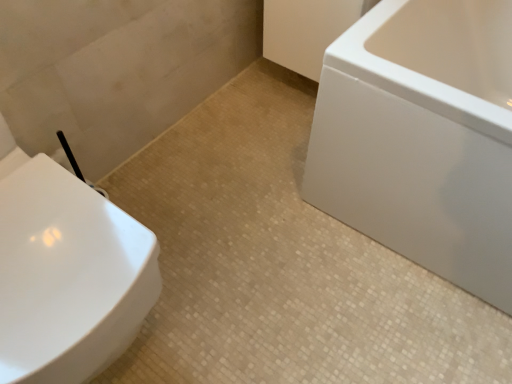
Question: From a real-world perspective, is white glossy bathtub at right positioned over beige mosaic tile at center based on gravity?

Choices:
 (A) yes
 (B) no

Answer: (A)

Question: Does white glossy bathtub at right appear on the left side of beige mosaic tile at center?

Choices:
 (A) yes
 (B) no

Answer: (B)

Question: Does white glossy bathtub at right appear on the right side of beige mosaic tile at center?

Choices:
 (A) yes
 (B) no

Answer: (A)

Question: Is the depth of white glossy bathtub at right less than that of beige mosaic tile at center?

Choices:
 (A) yes
 (B) no

Answer: (A)

Question: Can beige mosaic tile at center be found inside white glossy bathtub at right?

Choices:
 (A) no
 (B) yes

Answer: (A)

Question: Is white glossy bathtub at right further to camera compared to beige mosaic tile at center?

Choices:
 (A) no
 (B) yes

Answer: (A)

Question: Does beige mosaic tile at center have a larger size compared to white glossy toilet at left?

Choices:
 (A) yes
 (B) no

Answer: (B)

Question: Considering the relative positions of beige mosaic tile at center and white glossy toilet at left in the image provided, is beige mosaic tile at center behind white glossy toilet at left?

Choices:
 (A) yes
 (B) no

Answer: (A)

Question: From a real-world perspective, is beige mosaic tile at center beneath white glossy toilet at left?

Choices:
 (A) yes
 (B) no

Answer: (A)

Question: Considering the relative sizes of beige mosaic tile at center and white glossy toilet at left in the image provided, is beige mosaic tile at center smaller than white glossy toilet at left?

Choices:
 (A) no
 (B) yes

Answer: (B)

Question: Is white glossy toilet at left located within beige mosaic tile at center?

Choices:
 (A) no
 (B) yes

Answer: (A)

Question: From the image's perspective, would you say beige mosaic tile at center is shown under white glossy toilet at left?

Choices:
 (A) no
 (B) yes

Answer: (B)

Question: From a real-world perspective, is white glossy toilet at left under white glossy bathtub at right?

Choices:
 (A) yes
 (B) no

Answer: (B)